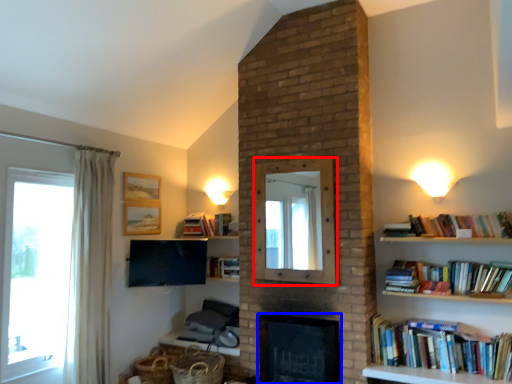
Question: Which of the following is the closest to the observer, mirror (highlighted by a red box) or fireplace (highlighted by a blue box)?

Choices:
 (A) mirror
 (B) fireplace

Answer: (B)